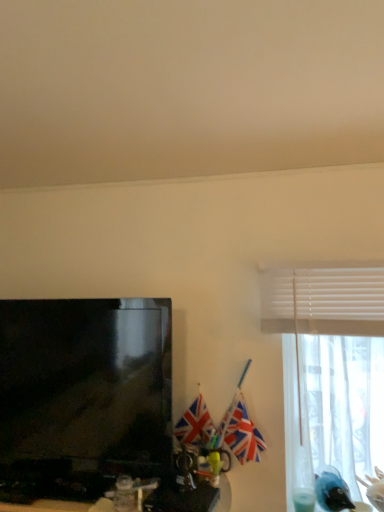
Question: Visually, is shiny plastic computer desk at lower left positioned to the left or to the right of union jack flag at right, positioned as the 1th flag in right-to-left order?

Choices:
 (A) left
 (B) right

Answer: (A)

Question: Is shiny plastic computer desk at lower left inside the boundaries of union jack flag at right, arranged as the 2th flag when viewed from the left, or outside?

Choices:
 (A) outside
 (B) inside

Answer: (A)

Question: Which object is the farthest from the shiny plastic computer desk at lower left?

Choices:
 (A) matte black television at left
 (B) union jack flag at right, positioned as the 1th flag in right-to-left order
 (C) sheer white curtain at right
 (D) polyester flag at center, marked as the second flag in a right-to-left arrangement

Answer: (C)

Question: Based on their relative distances, which object is farther from the polyester flag at center, the first flag when ordered from left to right?

Choices:
 (A) sheer white curtain at right
 (B) union jack flag at right, arranged as the 2th flag when viewed from the left
 (C) shiny plastic computer desk at lower left
 (D) matte black television at left

Answer: (A)